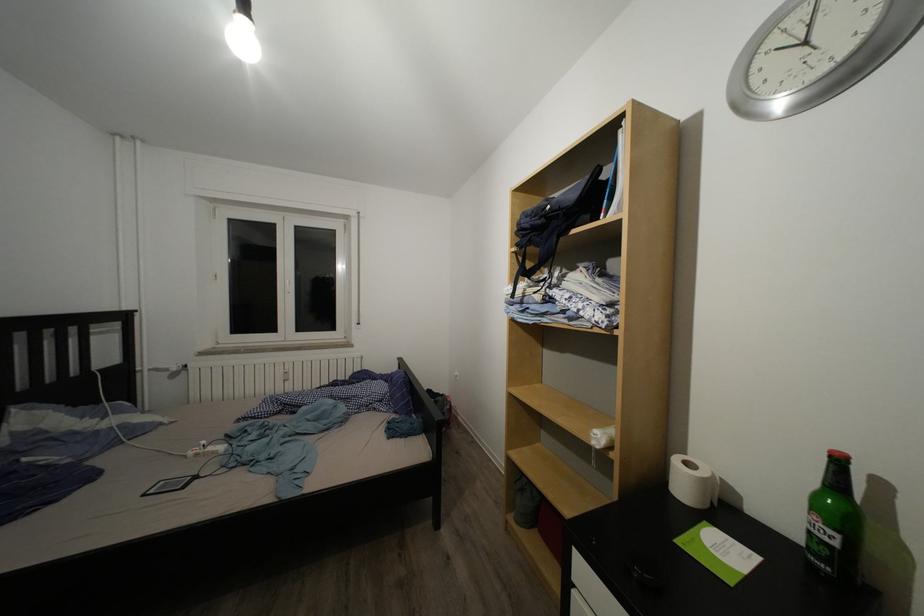
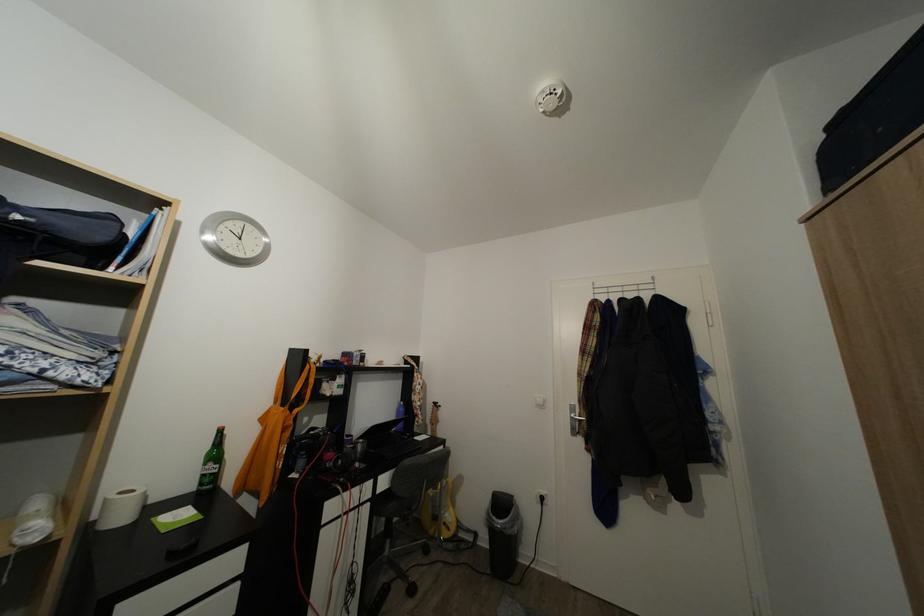
Find the pixel in the second image that matches [694,469] in the first image.

(129, 500)